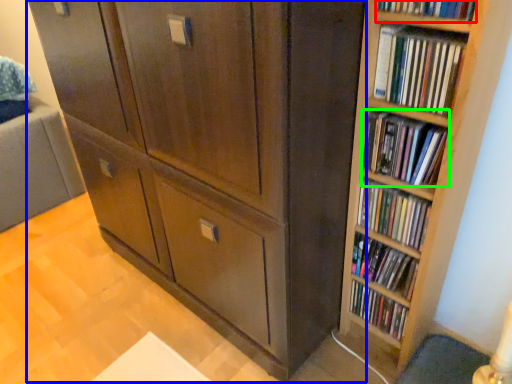
Question: Based on their relative distances, which object is nearer to book (highlighted by a red box)? Choose from cupboard (highlighted by a blue box) and book (highlighted by a green box).

Choices:
 (A) cupboard
 (B) book

Answer: (B)